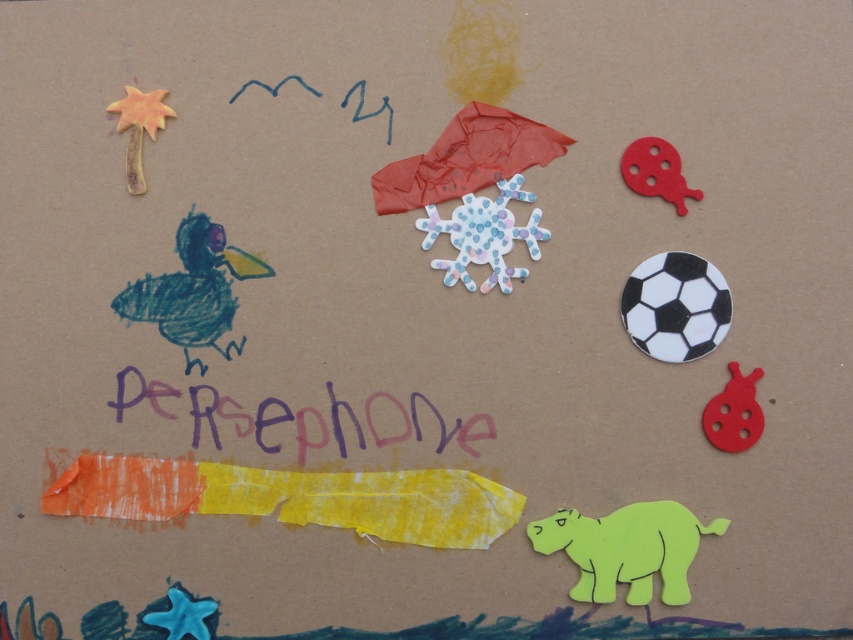
Based on the scene described, where is the neon green paper hippo at bottom right located in terms of coordinates?

The neon green paper hippo at bottom right is located at point coordinates of (625, 548).

You are a child trying to place a sticker exactly at the center of the artwork. The sticker is 2 cm in diameter. The artwork is on a brown cardboard background. You have a black and white matte soccer ball at upper right. Where should you place the sticker to ensure it doesn not overlap with any existing elements?

The black and white matte soccer ball at upper right is located at point [675,307]. To avoid overlapping, place the sticker at the geometric center of the artwork, which is at point [426,320]. Since the soccer ball is at [675,307], the distance between them is sufficient to prevent overlap with the 2 cm sticker.